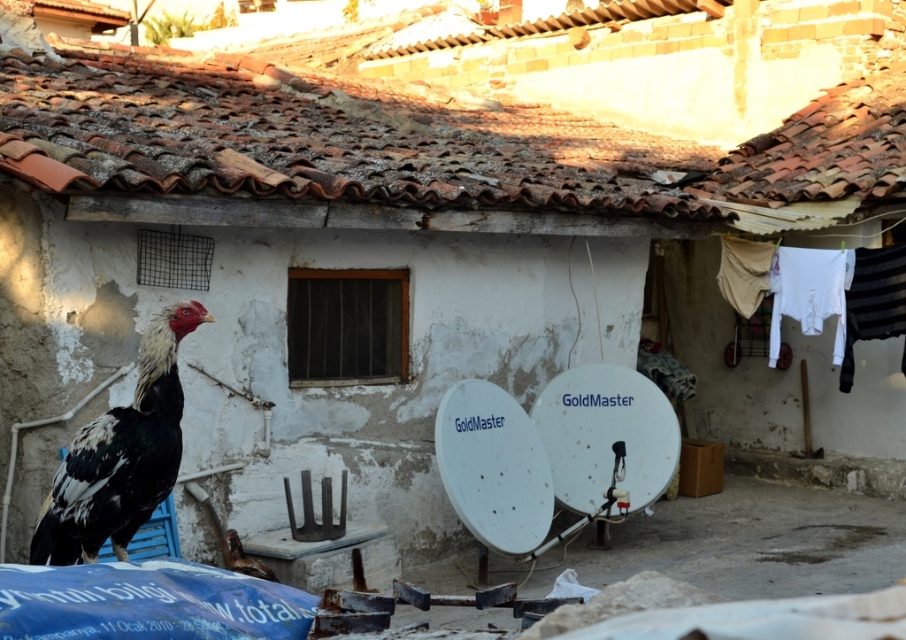
You are a farmer who wants to collect eggs from your chickens. You see a speckled feathered rooster at left and a brown feathered chicken at lower center. Which chicken should you approach to collect eggs?

You should approach the brown feathered chicken at lower center because roosters do not lay eggs.